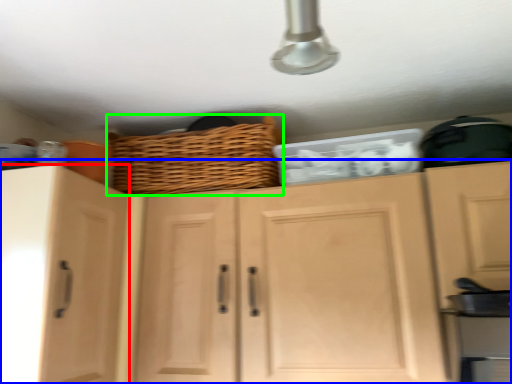
Question: Which object is the closest to the cabinetry (highlighted by a red box)? Choose among these: cabinetry (highlighted by a blue box) or basket (highlighted by a green box).

Choices:
 (A) cabinetry
 (B) basket

Answer: (A)